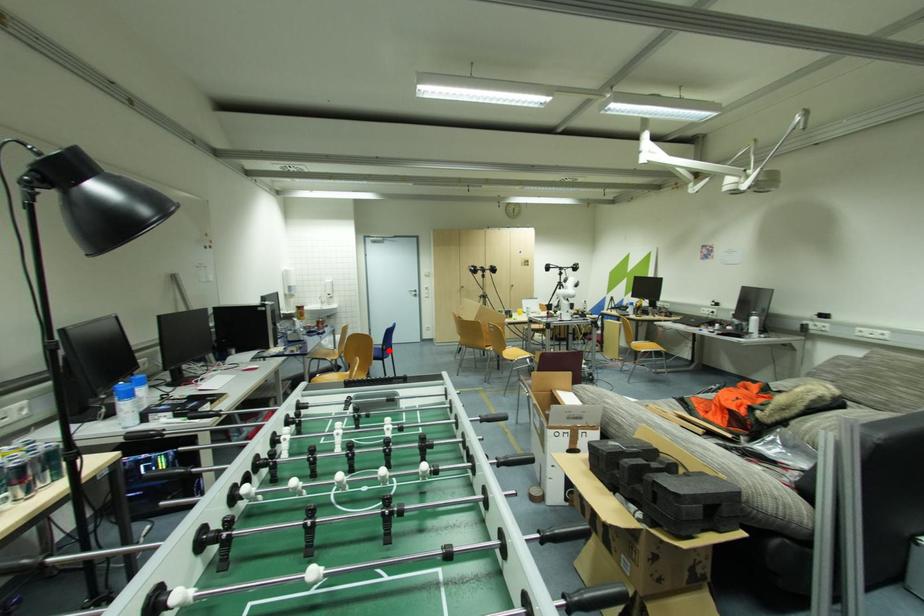
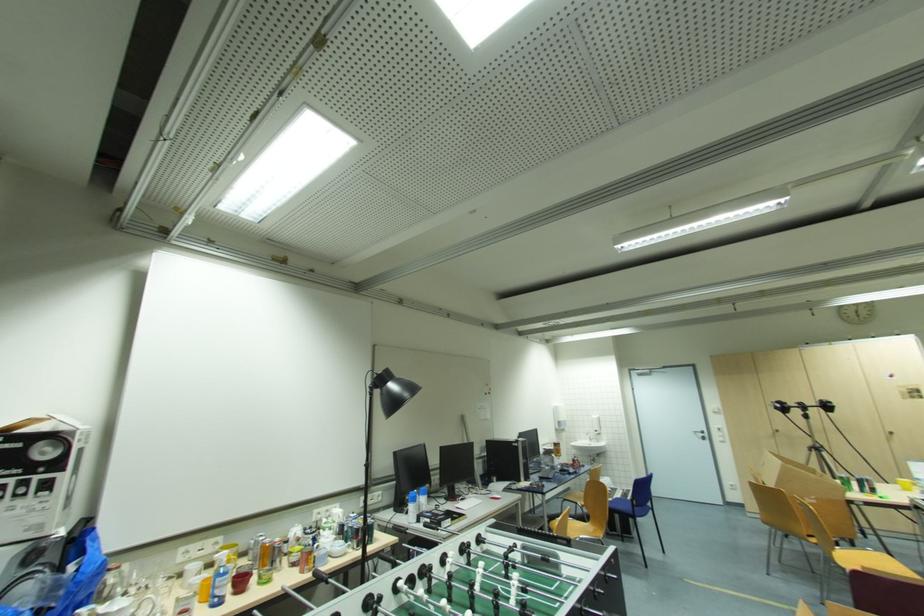
Question: I am providing you with two images of the same scene from different viewpoints. Image1 has a red point marked. In image2, the corresponding 3D location appears at what relative position? Reply with the corresponding letter.

Choices:
 (A) Closer
 (B) Farther

Answer: (A)